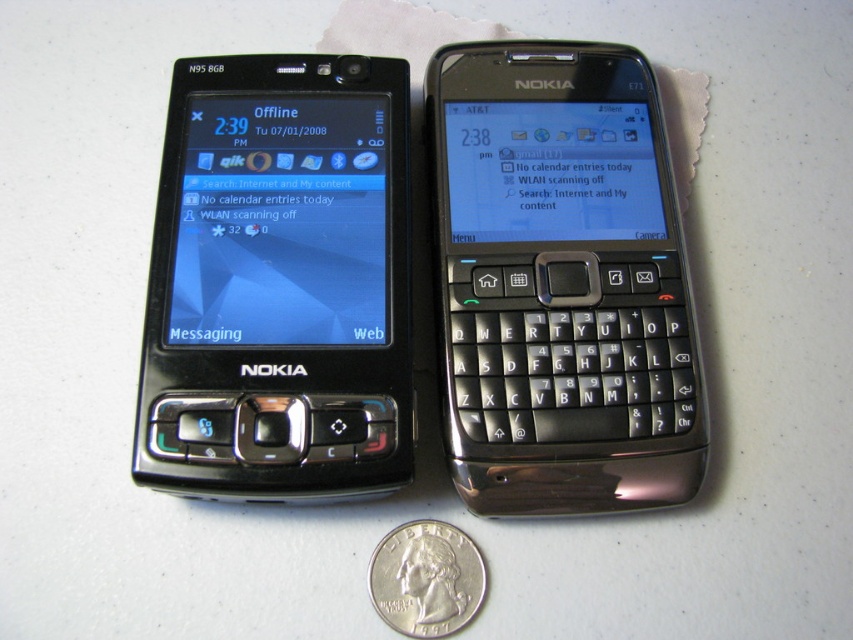
Question: Considering the relative positions of satin black phone at center and silver metallic quarter at lower center in the image provided, where is satin black phone at center located with respect to silver metallic quarter at lower center?

Choices:
 (A) above
 (B) below

Answer: (A)

Question: Is matte black phone at left further to the viewer compared to silver metallic quarter at lower center?

Choices:
 (A) yes
 (B) no

Answer: (B)

Question: Which object is closer to the camera taking this photo?

Choices:
 (A) satin black phone at center
 (B) silver metallic quarter at lower center

Answer: (B)

Question: Which point appears farthest from the camera in this image?

Choices:
 (A) (407, 529)
 (B) (244, 284)

Answer: (B)

Question: Does matte black phone at left come in front of silver metallic quarter at lower center?

Choices:
 (A) yes
 (B) no

Answer: (A)

Question: Which point is closer to the camera taking this photo?

Choices:
 (A) (344, 355)
 (B) (428, 586)

Answer: (B)